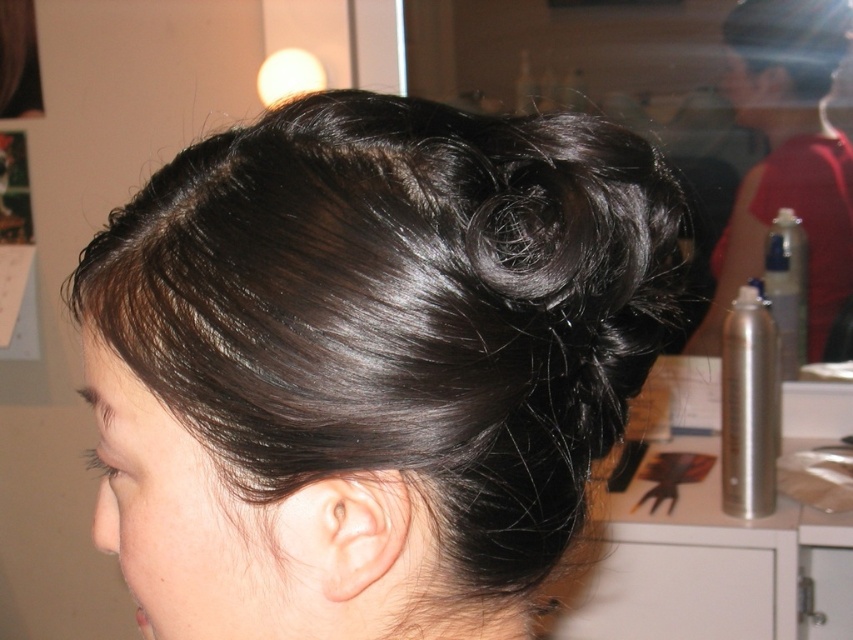
Question: Estimate the real-world distances between objects in this image. Which object is closer to the shiny dark hair bun at upper center?

Choices:
 (A) shiny dark brown hair at upper center
 (B) silver metallic spray can at right

Answer: (B)

Question: Which point is farther to the camera?

Choices:
 (A) (782, 33)
 (B) (106, 288)
 (C) (775, 36)

Answer: (C)

Question: Can you confirm if silver metallic spray can at right is smaller than shiny dark brown hair at upper center?

Choices:
 (A) yes
 (B) no

Answer: (B)

Question: Which point is closer to the camera?

Choices:
 (A) shiny dark hair bun at upper center
 (B) shiny dark brown hair at upper center
 (C) silver metallic spray can at right

Answer: (A)

Question: Is shiny dark hair bun at upper center to the left of shiny dark brown hair at upper center from the viewer's perspective?

Choices:
 (A) yes
 (B) no

Answer: (A)

Question: Observing the image, what is the correct spatial positioning of silver metallic spray can at right in reference to shiny dark brown hair at upper center?

Choices:
 (A) below
 (B) above

Answer: (A)